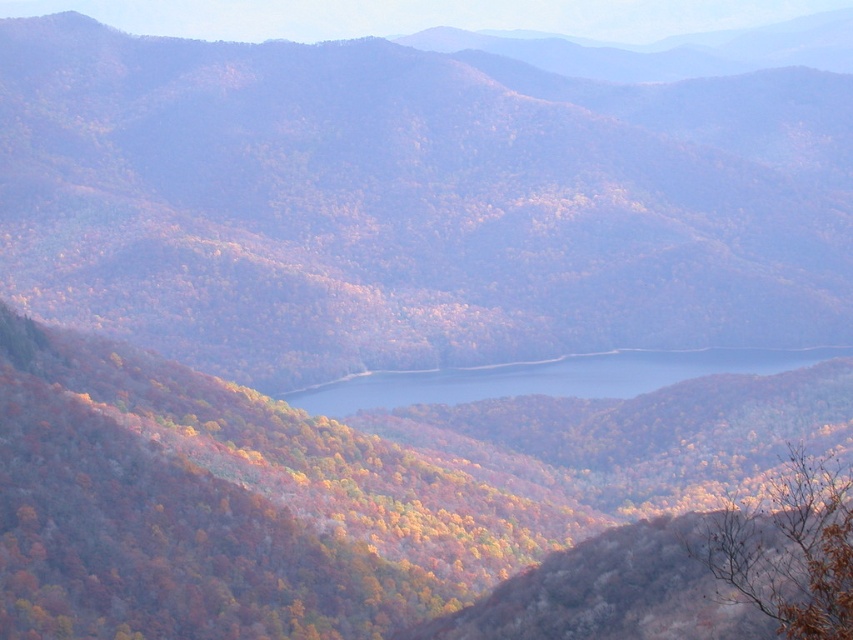
You are standing in the mountainous landscape and want to reach the point marked at coordinates point (48, 116) and point (819, 524). Which point is closer to you?

Point (48, 116) is closer to you because it is further to the viewer than point (819, 524).

You are an artist planning to paint this autumn landscape. You want to ensure the autumn leaves at center and blue glassy water at center are proportionally accurate. Based on the scene, which object should you paint larger?

The autumn leaves at center should be painted larger because it is larger in size than the blue glassy water at center according to the description.

Based on the photo, you are standing at the edge of the forest and see the brown matte tree at lower right and the blue glassy water at center. Which object is closer to your current position?

The brown matte tree at lower right is closer to your current position because it is positioned to the left of the blue glassy water at center, which is further away.